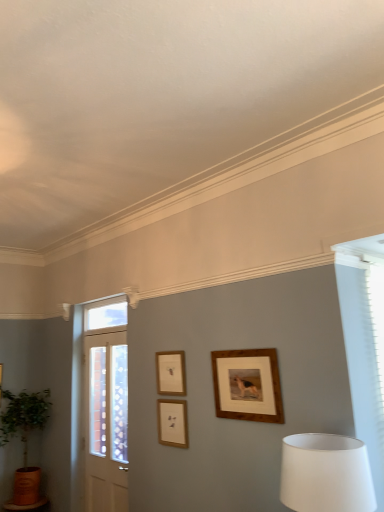
Question: Would you say green leafy plant in terracotta pot at lower left is outside white wood door at left?

Choices:
 (A) yes
 (B) no

Answer: (A)

Question: Can you confirm if green leafy plant in terracotta pot at lower left is shorter than white wood door at left?

Choices:
 (A) yes
 (B) no

Answer: (A)

Question: Does green leafy plant in terracotta pot at lower left have a lesser width compared to white wood door at left?

Choices:
 (A) yes
 (B) no

Answer: (B)

Question: From a real-world perspective, is green leafy plant in terracotta pot at lower left positioned under white wood door at left based on gravity?

Choices:
 (A) no
 (B) yes

Answer: (B)

Question: Is green leafy plant in terracotta pot at lower left positioned with its back to white wood door at left?

Choices:
 (A) no
 (B) yes

Answer: (A)

Question: Is white fabric lampshade at lower right spatially inside wooden picture frame at center, the 1th picture frame viewed from the right, or outside of it?

Choices:
 (A) inside
 (B) outside

Answer: (B)

Question: From a real-world perspective, is white fabric lampshade at lower right physically located above or below wooden picture frame at center, the 1th picture frame viewed from the right?

Choices:
 (A) above
 (B) below

Answer: (B)

Question: In terms of size, does white fabric lampshade at lower right appear bigger or smaller than wooden picture frame at center, the 1th picture frame viewed from the right?

Choices:
 (A) small
 (B) big

Answer: (B)

Question: Considering the positions of point 294,498 and point 221,375, is point 294,498 closer or farther from the camera than point 221,375?

Choices:
 (A) closer
 (B) farther

Answer: (A)

Question: Looking at their shapes, would you say green leafy plant in terracotta pot at lower left is wider or thinner than white wood door at left?

Choices:
 (A) wide
 (B) thin

Answer: (A)

Question: From the image's perspective, is green leafy plant in terracotta pot at lower left located above or below white wood door at left?

Choices:
 (A) above
 (B) below

Answer: (B)

Question: Would you say green leafy plant in terracotta pot at lower left is to the left or to the right of white wood door at left in the picture?

Choices:
 (A) right
 (B) left

Answer: (B)

Question: Is point (16, 407) positioned closer to the camera than point (82, 436)?

Choices:
 (A) farther
 (B) closer

Answer: (A)

Question: In terms of width, does clear glass window at upper center look wider or thinner when compared to white wood door at left?

Choices:
 (A) thin
 (B) wide

Answer: (B)

Question: Is clear glass window at upper center inside or outside of white wood door at left?

Choices:
 (A) inside
 (B) outside

Answer: (B)